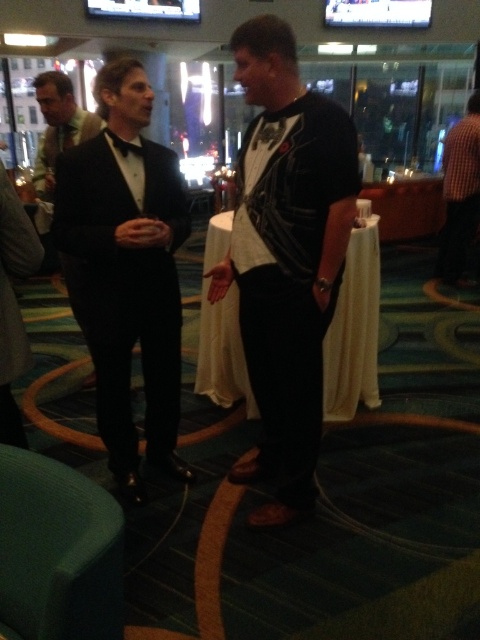
Question: Estimate the real-world distances between objects in this image. Which object is closer to the leather jacket at center?

Choices:
 (A) black satin tuxedo at left
 (B) matte black suit at left

Answer: (A)

Question: Among these objects, which one is nearest to the camera?

Choices:
 (A) checkered fabric shirt at right
 (B) leather jacket at center
 (C) matte black suit at left
 (D) black satin tuxedo at left

Answer: (B)

Question: Does black satin tuxedo at left appear on the left side of matte black suit at left?

Choices:
 (A) no
 (B) yes

Answer: (A)

Question: Which point is farther to the camera?

Choices:
 (A) checkered fabric shirt at right
 (B) leather jacket at center
 (C) black satin tuxedo at left
 (D) matte black suit at left

Answer: (A)

Question: Is checkered fabric shirt at right to the left of matte black suit at left from the viewer's perspective?

Choices:
 (A) yes
 (B) no

Answer: (B)

Question: Where is checkered fabric shirt at right located in relation to matte black suit at left in the image?

Choices:
 (A) left
 (B) right

Answer: (B)